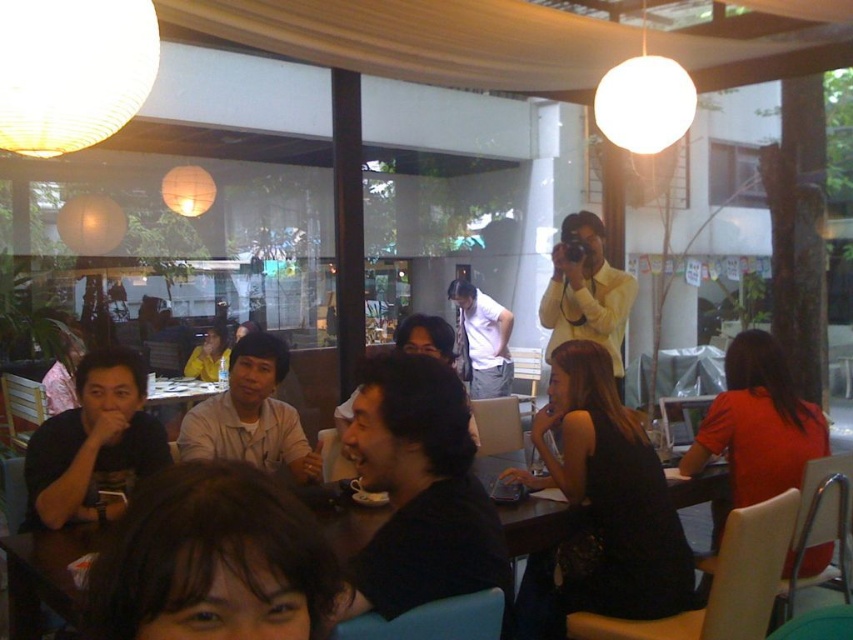
Is point (544, 589) in front of point (138, 426)?

No.

In the scene shown: Who is positioned more to the right, black matte dress at center or black matte shirt at left?

black matte dress at center

Who is more forward, (616, 422) or (155, 456)?

Point (616, 422) is more forward.

I want to click on black matte dress at center, so click(x=601, y=506).

Does black matte shirt at left appear under red matte shirt at right?

Correct, black matte shirt at left is located below red matte shirt at right.

Is black matte shirt at left above red matte shirt at right?

Incorrect, black matte shirt at left is not positioned above red matte shirt at right.

Locate an element on the screen. This screenshot has width=853, height=640. black matte shirt at left is located at coordinates (93, 444).

Who is higher up, red matte shirt at right or yellow matte shirt at center?

yellow matte shirt at center is higher up.

Identify the location of red matte shirt at right. (758, 422).

Measure the distance between point (817, 456) and camera.

2.83 meters

Image resolution: width=853 pixels, height=640 pixels. What are the coordinates of `red matte shirt at right` in the screenshot? It's located at coord(758,422).